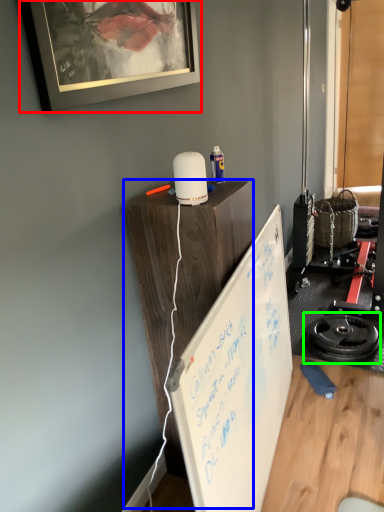
Question: Based on their relative distances, which object is farther from picture frame (highlighted by a red box)? Choose from table (highlighted by a blue box) and wheel (highlighted by a green box).

Choices:
 (A) table
 (B) wheel

Answer: (B)